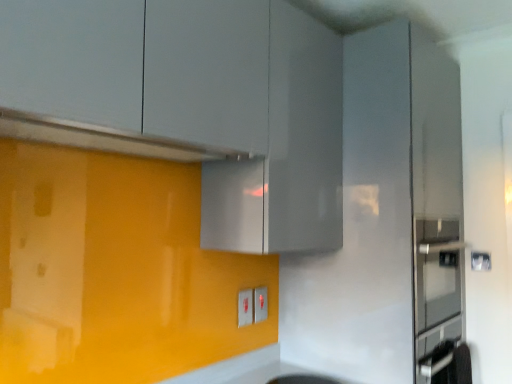
Describe the element at coordinates (103, 138) in the screenshot. I see `satin silver exhaust hood at upper center` at that location.

Measure the distance between point (191, 159) and camera.

1.63 meters.

Identify the location of matte gray cabinet at upper center. This screenshot has height=384, width=512. (192, 103).

In order to face matte gray cabinet at upper center, should I rotate leftwards or rightwards?

It's best to rotate left around 7.124 degrees.

Where is `white plastic electric outlet at center, the first electric outlet positioned from the left`? The image size is (512, 384). white plastic electric outlet at center, the first electric outlet positioned from the left is located at coordinates (245, 307).

What's the angular difference between satin silver exhaust hood at upper center and white plastic electric outlet at center, the first electric outlet positioned from the left,'s facing directions?

They differ by 1.22 degrees in their facing directions.

Based on their positions, is satin silver exhaust hood at upper center located to the left or right of white plastic electric outlet at center, the first electric outlet positioned from the left?

Based on their positions, satin silver exhaust hood at upper center is located to the left of white plastic electric outlet at center, the first electric outlet positioned from the left.

In the scene shown: Is satin silver exhaust hood at upper center thinner than white plastic electric outlet at center, placed as the second electric outlet when sorted from back to front?

No, satin silver exhaust hood at upper center is not thinner than white plastic electric outlet at center, placed as the second electric outlet when sorted from back to front.

From the image's perspective, which electric outlet is the 2nd one below the matte gray cabinet at upper center? Please provide its 2D coordinates.

[(260, 304)]

Considering the sizes of matte white electric outlet at lower center, arranged as the second electric outlet when viewed from the front, and matte gray cabinet at upper center in the image, is matte white electric outlet at lower center, arranged as the second electric outlet when viewed from the front, bigger or smaller than matte gray cabinet at upper center?

Considering their sizes, matte white electric outlet at lower center, arranged as the second electric outlet when viewed from the front, takes up less space than matte gray cabinet at upper center.

How many degrees apart are the facing directions of matte white electric outlet at lower center, which appears as the 2th electric outlet when viewed from the left, and matte gray cabinet at upper center?

1.94 degrees separate the facing orientations of matte white electric outlet at lower center, which appears as the 2th electric outlet when viewed from the left, and matte gray cabinet at upper center.

Which object is positioned more to the left, matte white electric outlet at lower center, which appears as the 2th electric outlet when viewed from the left, or matte gray cabinet at upper center?

matte gray cabinet at upper center.

Between matte gray cabinet at upper center and white plastic electric outlet at center, the 1th electric outlet in the front-to-back sequence, which one has smaller width?

Thinner between the two is white plastic electric outlet at center, the 1th electric outlet in the front-to-back sequence.

From a real-world perspective, is matte gray cabinet at upper center positioned under white plastic electric outlet at center, the first electric outlet positioned from the left, based on gravity?

Incorrect, from a real-world perspective, matte gray cabinet at upper center is higher than white plastic electric outlet at center, the first electric outlet positioned from the left.

Could you measure the distance between matte gray cabinet at upper center and white plastic electric outlet at center, the 1th electric outlet in the front-to-back sequence?

The distance of matte gray cabinet at upper center from white plastic electric outlet at center, the 1th electric outlet in the front-to-back sequence, is 82.78 centimeters.

Is point (54, 112) closer or farther from the camera than point (240, 292)?

Clearly, point (54, 112) is closer to the camera than point (240, 292).

From a real-world perspective, does white plastic electric outlet at center, the first electric outlet positioned from the left, stand above matte gray cabinet at upper center?

No.

Which object is positioned more to the right, white plastic electric outlet at center, the 1th electric outlet in the front-to-back sequence, or matte gray cabinet at upper center?

white plastic electric outlet at center, the 1th electric outlet in the front-to-back sequence.

Is white plastic electric outlet at center, the 1th electric outlet in the front-to-back sequence, spatially inside matte gray cabinet at upper center, or outside of it?

white plastic electric outlet at center, the 1th electric outlet in the front-to-back sequence, is located beyond the bounds of matte gray cabinet at upper center.

Which is in front, matte gray cabinet at upper center or matte white electric outlet at lower center, which appears as the 2th electric outlet when viewed from the left?

matte gray cabinet at upper center is closer to the camera.

Which is correct: matte gray cabinet at upper center is inside matte white electric outlet at lower center, which is the first electric outlet from right to left, or outside of it?

matte gray cabinet at upper center is spatially situated outside matte white electric outlet at lower center, which is the first electric outlet from right to left.

From a real-world perspective, which is physically above, matte gray cabinet at upper center or matte white electric outlet at lower center, which appears as the 2th electric outlet when viewed from the left?

In real-world perspective, matte gray cabinet at upper center is above.

Is matte gray cabinet at upper center at the right side of satin silver exhaust hood at upper center?

Yes, matte gray cabinet at upper center is to the right of satin silver exhaust hood at upper center.

Does matte gray cabinet at upper center come behind satin silver exhaust hood at upper center?

No, matte gray cabinet at upper center is closer to the viewer.

Measure the distance between matte gray cabinet at upper center and satin silver exhaust hood at upper center.

The distance of matte gray cabinet at upper center from satin silver exhaust hood at upper center is 8.48 inches.

Is matte gray cabinet at upper center wider or thinner than satin silver exhaust hood at upper center?

Answer: Clearly, matte gray cabinet at upper center has more width compared to satin silver exhaust hood at upper center.

From the image's perspective, relative to matte gray cabinet at upper center, is satin silver exhaust hood at upper center above or below?

satin silver exhaust hood at upper center is below matte gray cabinet at upper center.

Which object is closer to the camera, satin silver exhaust hood at upper center or matte gray cabinet at upper center?

matte gray cabinet at upper center is closer to the camera.

Is satin silver exhaust hood at upper center facing away from matte gray cabinet at upper center?

Correct, satin silver exhaust hood at upper center is looking away from matte gray cabinet at upper center.

The image size is (512, 384). In order to click on cabinetry located above the satin silver exhaust hood at upper center (from a real-world perspective) in this screenshot , I will do `click(192, 103)`.

Where is `exhaust hood lying on the left of white plastic electric outlet at center, the 1th electric outlet in the front-to-back sequence`? This screenshot has width=512, height=384. exhaust hood lying on the left of white plastic electric outlet at center, the 1th electric outlet in the front-to-back sequence is located at coordinates (103, 138).

Where is `the 2nd electric outlet below when counting from the matte gray cabinet at upper center (from the image's perspective)`? The image size is (512, 384). the 2nd electric outlet below when counting from the matte gray cabinet at upper center (from the image's perspective) is located at coordinates (260, 304).

From the image, which object appears to be nearer to matte white electric outlet at lower center, arranged as the second electric outlet when viewed from the front, white plastic electric outlet at center, the first electric outlet positioned from the left, or satin silver exhaust hood at upper center?

Based on the image, white plastic electric outlet at center, the first electric outlet positioned from the left, appears to be nearer to matte white electric outlet at lower center, arranged as the second electric outlet when viewed from the front.

Considering their positions, is white plastic electric outlet at center, the 2th electric outlet positioned from the right, positioned closer to matte gray cabinet at upper center than satin silver exhaust hood at upper center?

satin silver exhaust hood at upper center is closer to matte gray cabinet at upper center.

Estimate the real-world distances between objects in this image. Which object is further from satin silver exhaust hood at upper center, matte white electric outlet at lower center, which is the first electric outlet from right to left, or matte gray cabinet at upper center?

matte white electric outlet at lower center, which is the first electric outlet from right to left, lies further to satin silver exhaust hood at upper center than the other object.

Considering their positions, is satin silver exhaust hood at upper center positioned further to matte gray cabinet at upper center than white plastic electric outlet at center, placed as the second electric outlet when sorted from back to front?

Based on the image, white plastic electric outlet at center, placed as the second electric outlet when sorted from back to front, appears to be further to matte gray cabinet at upper center.

From the image, which object appears to be nearer to matte gray cabinet at upper center, white plastic electric outlet at center, the 2th electric outlet positioned from the right, or matte white electric outlet at lower center, which is the 1th electric outlet from back to front?

white plastic electric outlet at center, the 2th electric outlet positioned from the right, is closer to matte gray cabinet at upper center.

Based on their spatial positions, is white plastic electric outlet at center, placed as the second electric outlet when sorted from back to front, or matte gray cabinet at upper center further from matte white electric outlet at lower center, which is the first electric outlet from right to left?

matte gray cabinet at upper center is further to matte white electric outlet at lower center, which is the first electric outlet from right to left.

From the picture: Estimate the real-world distances between objects in this image. Which object is closer to matte white electric outlet at lower center, arranged as the second electric outlet when viewed from the front, matte gray cabinet at upper center or white plastic electric outlet at center, the first electric outlet positioned from the left?

white plastic electric outlet at center, the first electric outlet positioned from the left, is positioned closer to the anchor matte white electric outlet at lower center, arranged as the second electric outlet when viewed from the front.

Looking at the image, which one is located further to white plastic electric outlet at center, the 1th electric outlet in the front-to-back sequence, matte white electric outlet at lower center, which is the first electric outlet from right to left, or matte gray cabinet at upper center?

The object further to white plastic electric outlet at center, the 1th electric outlet in the front-to-back sequence, is matte gray cabinet at upper center.

The image size is (512, 384). I want to click on electric outlet between matte gray cabinet at upper center and matte white electric outlet at lower center, which appears as the 2th electric outlet when viewed from the left, in the front-back direction, so click(245, 307).

Image resolution: width=512 pixels, height=384 pixels. I want to click on exhaust hood located between matte gray cabinet at upper center and white plastic electric outlet at center, the 2th electric outlet positioned from the right, in the depth direction, so (x=103, y=138).

The width and height of the screenshot is (512, 384). What are the coordinates of `exhaust hood between matte gray cabinet at upper center and matte white electric outlet at lower center, which is the first electric outlet from right to left, along the z-axis` in the screenshot? It's located at (103, 138).

The image size is (512, 384). What are the coordinates of `electric outlet between satin silver exhaust hood at upper center and matte white electric outlet at lower center, arranged as the second electric outlet when viewed from the front, in the front-back direction` in the screenshot? It's located at (245, 307).